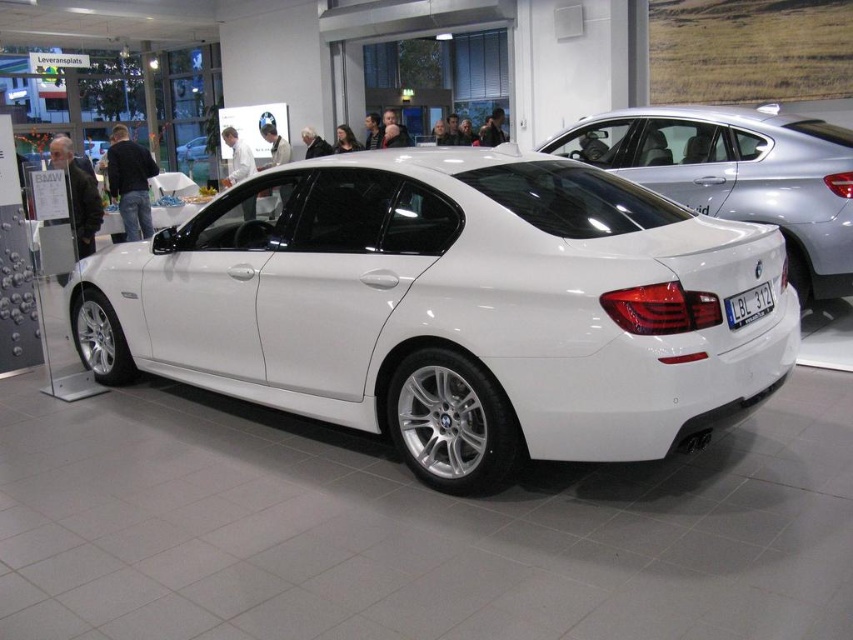
How distant is white metallic car at center from blue metallic license plate at rear?

1.32 meters

Is white metallic car at center positioned in front of blue metallic license plate at rear?

Yes, white metallic car at center is in front of blue metallic license plate at rear.

Describe the element at coordinates (451, 308) in the screenshot. I see `white metallic car at center` at that location.

I want to click on white metallic car at center, so click(451, 308).

Which is more to the left, white metallic car at center or white glossy sedan at center?

white metallic car at center is more to the left.

Between point (189, 344) and point (595, 132), which one is positioned in front?

Positioned in front is point (189, 344).

Identify the location of white metallic car at center. (451, 308).

Is white glossy sedan at center to the right of blue metallic license plate at rear from the viewer's perspective?

Indeed, white glossy sedan at center is positioned on the right side of blue metallic license plate at rear.

What do you see at coordinates (737, 173) in the screenshot? Image resolution: width=853 pixels, height=640 pixels. I see `white glossy sedan at center` at bounding box center [737, 173].

Measure the distance between white glossy sedan at center and camera.

A distance of 16.20 feet exists between white glossy sedan at center and camera.

This screenshot has height=640, width=853. Identify the location of white glossy sedan at center. (737, 173).